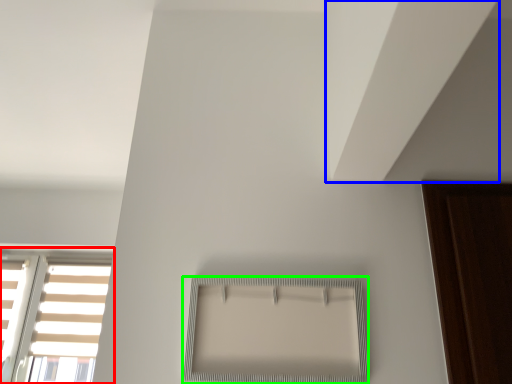
Question: Which object is positioned farthest from window (highlighted by a red box)? Select from blind (highlighted by a blue box) and window (highlighted by a green box).

Choices:
 (A) blind
 (B) window

Answer: (A)